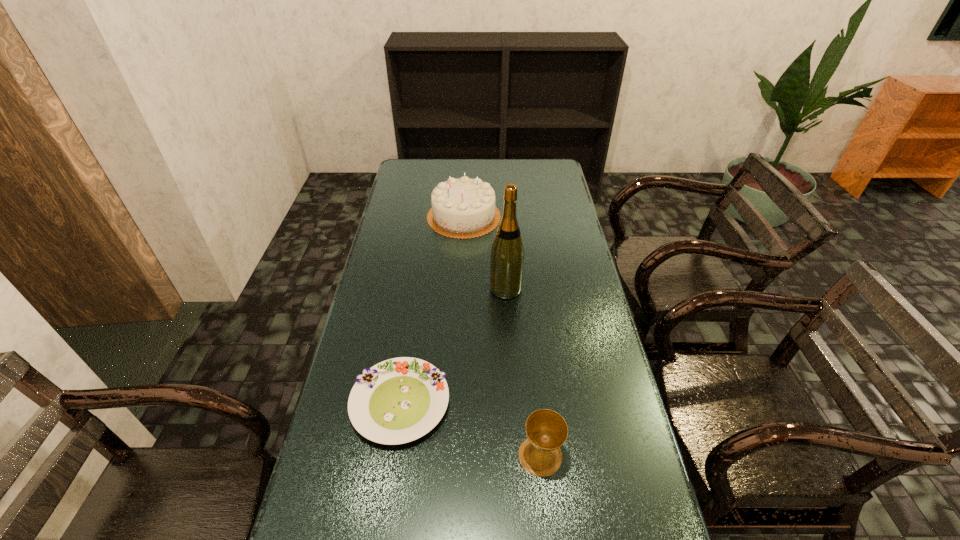
You are a GUI agent. You are given a task and a screenshot of the screen. Output one action in this format:
    pyautogui.click(x=<x>, y=<y>)
    Task: Click on the free spot that satisfies the following two spatial constraints: 1. on the front side of the third shortest object; 2. on the left side of the third tallest object
    
    Given the screenshot: What is the action you would take?
    pyautogui.click(x=452, y=456)

Image resolution: width=960 pixels, height=540 pixels. I want to click on free space that satisfies the following two spatial constraints: 1. on the front-facing side of the third nearest object; 2. on the front side of the shortest object, so click(513, 403).

The image size is (960, 540). Identify the location of free location that satisfies the following two spatial constraints: 1. on the front side of the second shortest object; 2. on the right side of the salad plate. (392, 456).

The height and width of the screenshot is (540, 960). In order to click on free space in the image that satisfies the following two spatial constraints: 1. on the front-facing side of the second shortest object; 2. on the left side of the tallest object in this screenshot , I will do `click(516, 456)`.

The width and height of the screenshot is (960, 540). In order to click on free space that satisfies the following two spatial constraints: 1. on the back side of the third tallest object; 2. on the front-facing side of the third nearest object in this screenshot , I will do `click(523, 288)`.